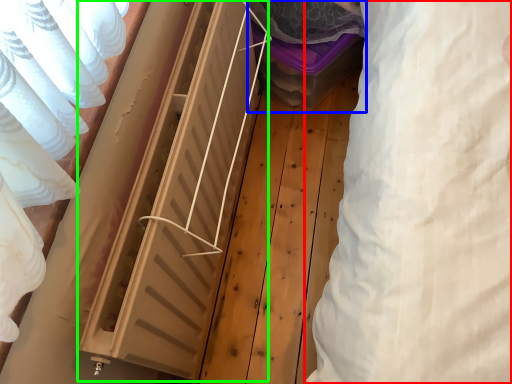
Question: Estimate the real-world distances between objects in this image. Which object is closer to clothing (highlighted by a red box), storage box (highlighted by a blue box) or radiator (highlighted by a green box)?

Choices:
 (A) storage box
 (B) radiator

Answer: (B)